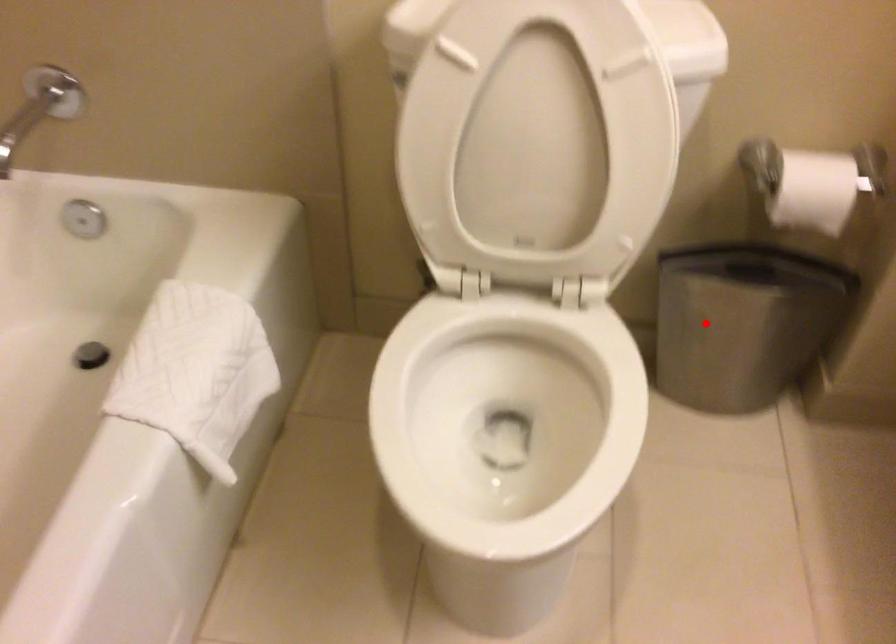
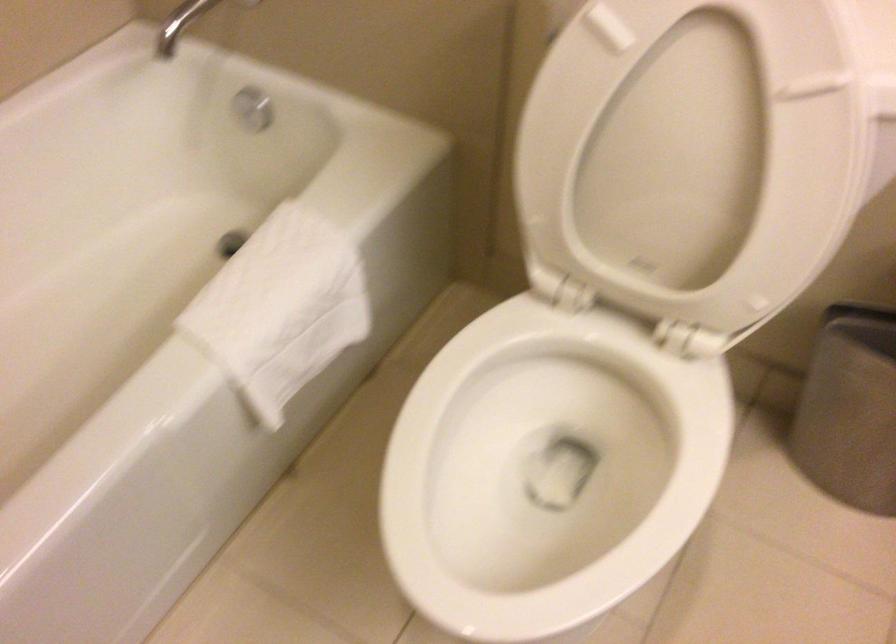
Question: A red point is marked in image1. In image2, is the corresponding 3D point closer to the camera or farther? Reply with the corresponding letter.

Choices:
 (A) The corresponding 3D point is closer.
 (B) The corresponding 3D point is farther.

Answer: (A)